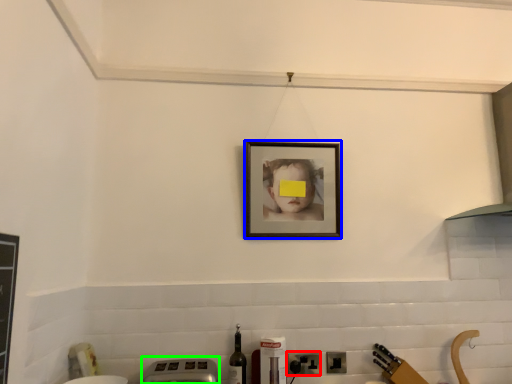
Question: Estimate the real-world distances between objects in this image. Which object is closer to electric outlet (highlighted by a red box), picture frame (highlighted by a blue box) or appliance (highlighted by a green box)?

Choices:
 (A) picture frame
 (B) appliance

Answer: (B)